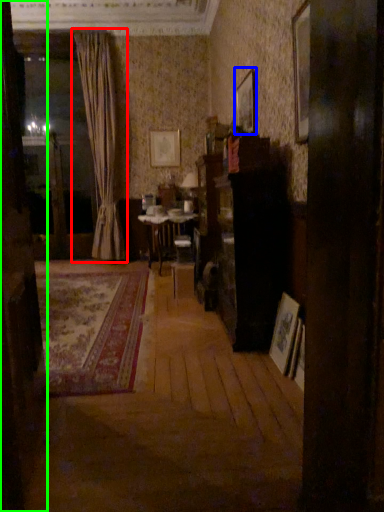
Question: Estimate the real-world distances between objects in this image. Which object is farther from curtain (highlighted by a red box), picture frame (highlighted by a blue box) or door (highlighted by a green box)?

Choices:
 (A) picture frame
 (B) door

Answer: (B)